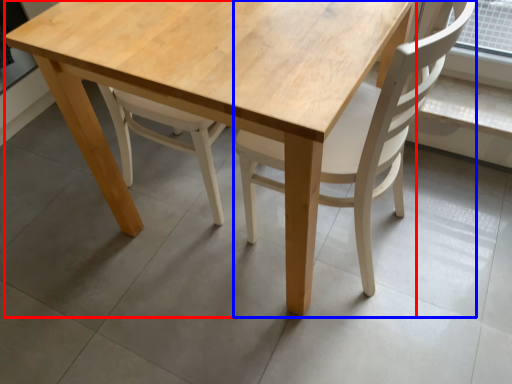
Question: Which of the following is the closest to the observer, round table (highlighted by a red box) or chair (highlighted by a blue box)?

Choices:
 (A) round table
 (B) chair

Answer: (B)